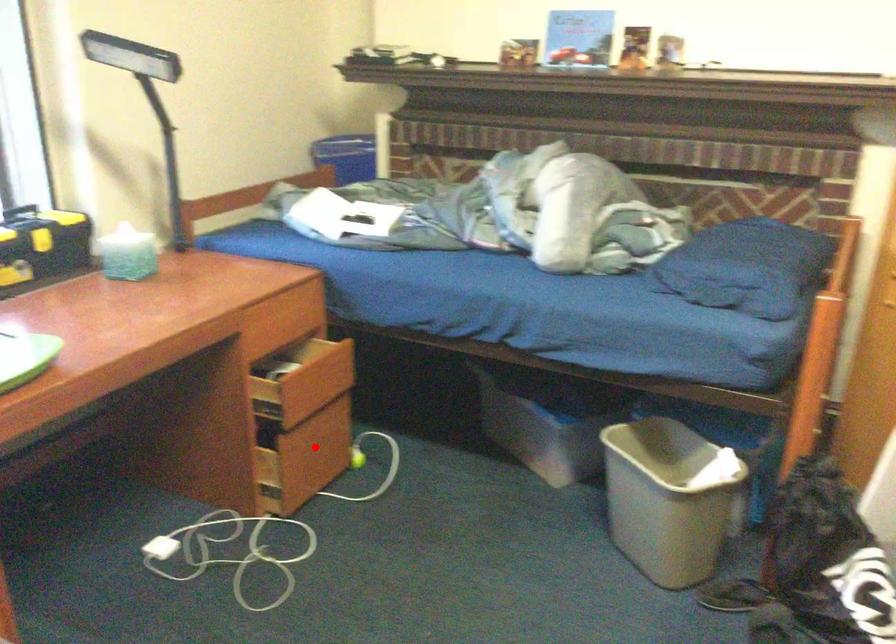
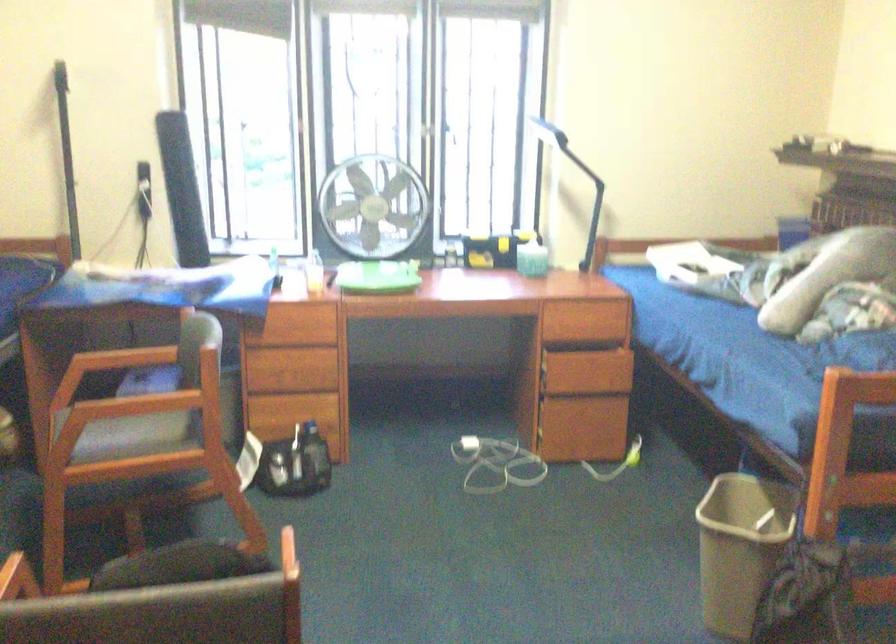
The point at the highlighted location is marked in the first image. Where is the corresponding point in the second image?

(599, 424)